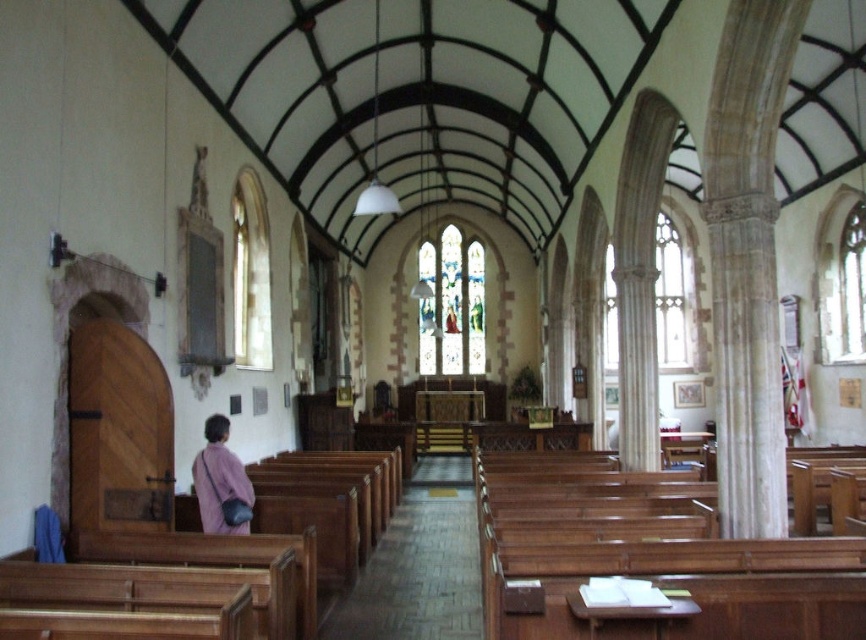
You are standing at the entrance of the church and see the brown wooden aisle at center and the pink fabric bag at lower left. Which object is closer to your left side?

The pink fabric bag at lower left is closer to your left side since it is positioned to the left of the brown wooden aisle at center.

You are standing in the church and want to place the pink fabric bag at lower left on the brown wooden aisle at center. Can you do this without the bag falling off?

The brown wooden aisle at center has a greater height compared to pink fabric bag at lower left, so the bag will not fall off when placed on it.

You are standing in the church and want to know how far you are from the point marked at coordinates (431, 552). Can you determine the distance?

The point marked at coordinates (431, 552) is 34.12 meters away from you.